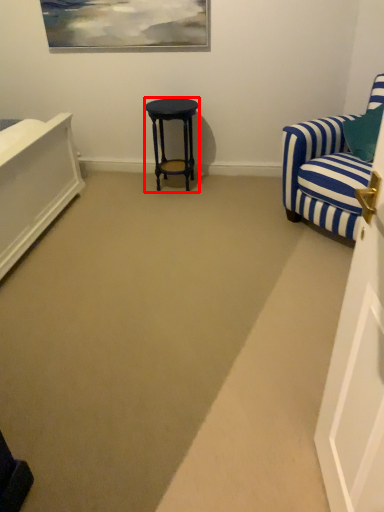
Question: From the image's perspective, where is stool (annotated by the red box) located relative to chair?

Choices:
 (A) below
 (B) above

Answer: (B)